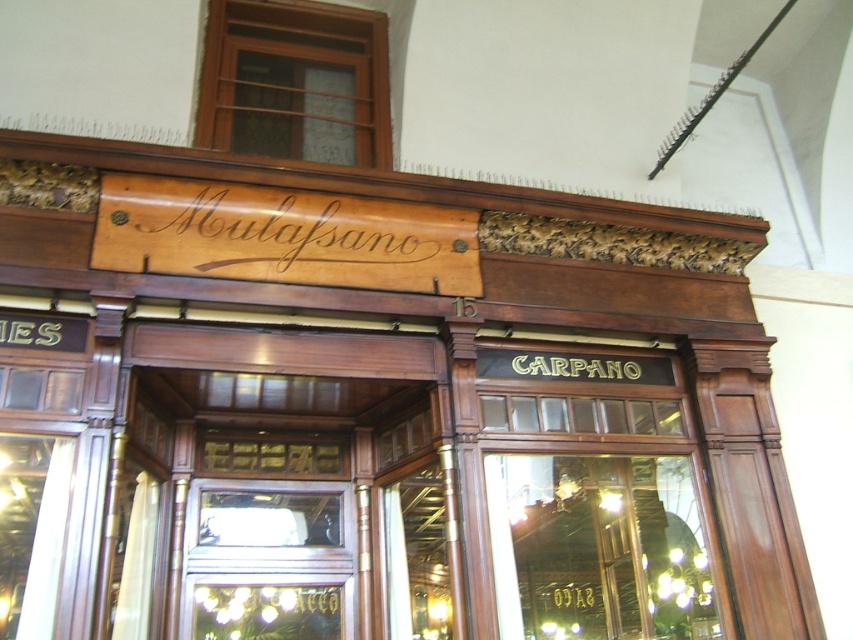
This screenshot has height=640, width=853. Find the location of `transparent glass door at center`. transparent glass door at center is located at coordinates point(598,547).

Image resolution: width=853 pixels, height=640 pixels. What are the coordinates of `transparent glass door at center` in the screenshot? It's located at (598, 547).

The image size is (853, 640). I want to click on transparent glass door at center, so click(x=598, y=547).